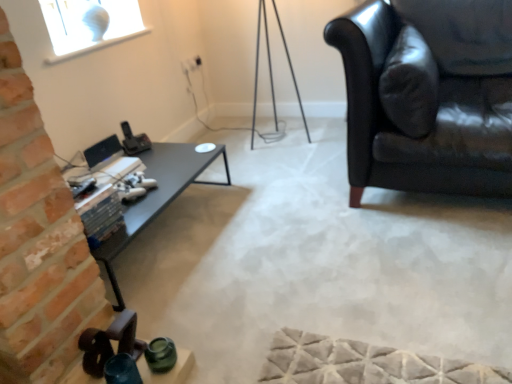
Identify the location of free space to the left of satin black monitor at center. (83, 163).